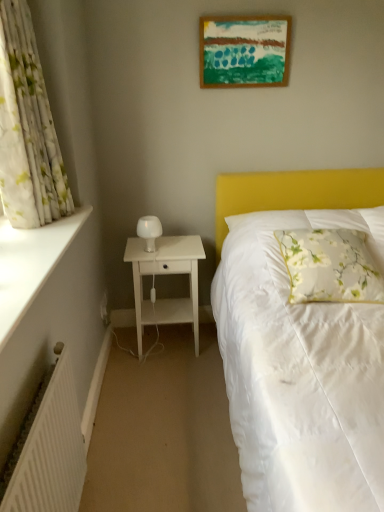
Question: From a real-world perspective, is white ribbed radiator at lower left positioned under floral fabric pillow at right based on gravity?

Choices:
 (A) no
 (B) yes

Answer: (B)

Question: Does white ribbed radiator at lower left turn towards floral fabric pillow at right?

Choices:
 (A) no
 (B) yes

Answer: (A)

Question: Considering the relative sizes of white ribbed radiator at lower left and floral fabric pillow at right in the image provided, is white ribbed radiator at lower left taller than floral fabric pillow at right?

Choices:
 (A) yes
 (B) no

Answer: (A)

Question: Is white ribbed radiator at lower left wider than floral fabric pillow at right?

Choices:
 (A) no
 (B) yes

Answer: (A)

Question: Is white ribbed radiator at lower left further to camera compared to floral fabric pillow at right?

Choices:
 (A) no
 (B) yes

Answer: (A)

Question: Is white matte nightstand at left in front of or behind white smooth window sill at left in the image?

Choices:
 (A) behind
 (B) front

Answer: (A)

Question: Visually, is white matte nightstand at left positioned to the left or to the right of white smooth window sill at left?

Choices:
 (A) left
 (B) right

Answer: (B)

Question: Is white matte nightstand at left bigger or smaller than white smooth window sill at left?

Choices:
 (A) small
 (B) big

Answer: (B)

Question: Looking at their shapes, would you say white matte nightstand at left is wider or thinner than white smooth window sill at left?

Choices:
 (A) wide
 (B) thin

Answer: (A)

Question: From the image's perspective, relative to white ribbed radiator at lower left, is white glossy bedside lamp at left above or below?

Choices:
 (A) below
 (B) above

Answer: (B)

Question: Visually, is white glossy bedside lamp at left positioned to the left or to the right of white ribbed radiator at lower left?

Choices:
 (A) left
 (B) right

Answer: (B)

Question: In the image, is white glossy bedside lamp at left positioned in front of or behind white ribbed radiator at lower left?

Choices:
 (A) behind
 (B) front

Answer: (A)

Question: In terms of width, does white glossy bedside lamp at left look wider or thinner when compared to white ribbed radiator at lower left?

Choices:
 (A) thin
 (B) wide

Answer: (B)

Question: Based on their positions, is white matte nightstand at left located to the left or right of floral fabric pillow at right?

Choices:
 (A) right
 (B) left

Answer: (B)

Question: From their relative heights in the image, would you say white matte nightstand at left is taller or shorter than floral fabric pillow at right?

Choices:
 (A) tall
 (B) short

Answer: (A)